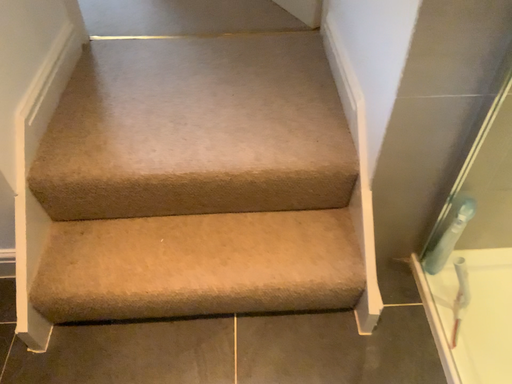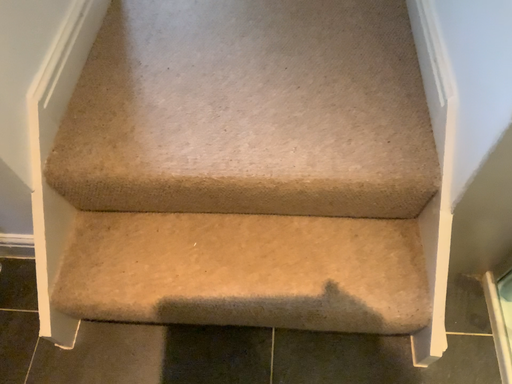
Question: Which way did the camera rotate in the video?

Choices:
 (A) rotated downward
 (B) rotated upward

Answer: (A)